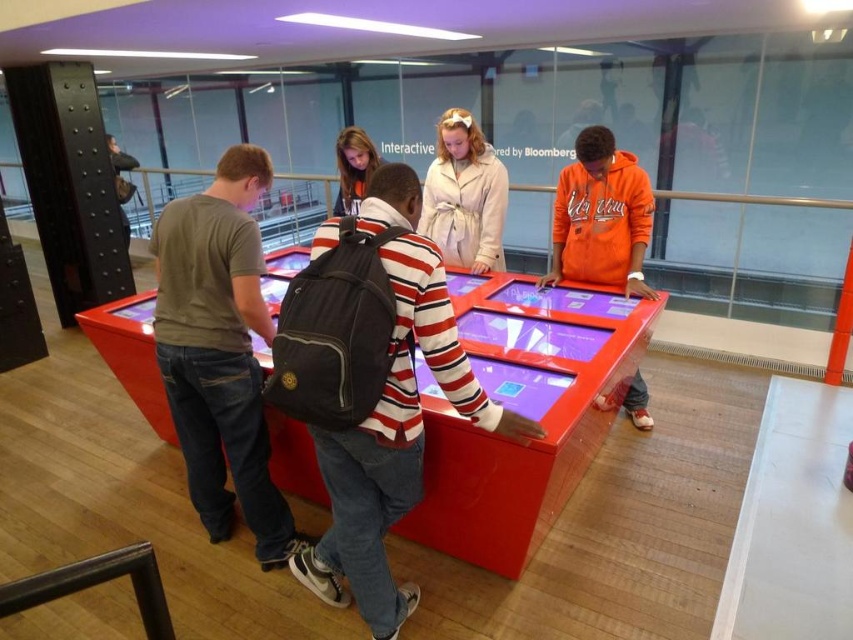
Can you confirm if orange fleece jacket at right is positioned above matte black backpack at center?

Incorrect, orange fleece jacket at right is not positioned above matte black backpack at center.

Can you confirm if orange fleece jacket at right is taller than matte black backpack at center?

Yes, orange fleece jacket at right is taller than matte black backpack at center.

The width and height of the screenshot is (853, 640). Find the location of `orange fleece jacket at right`. orange fleece jacket at right is located at coordinates (601, 216).

Does point (160, 234) lie behind point (419, 464)?

Yes, it is.

Does matte gray shirt at left have a greater width compared to striped cotton shirt at center?

In fact, matte gray shirt at left might be narrower than striped cotton shirt at center.

Between point (207, 332) and point (347, 547), which one is positioned behind?

The point (207, 332) is behind.

Locate an element on the screen. matte gray shirt at left is located at coordinates (219, 353).

Is orange fleece jacket at right to the right of dark gray backpack at upper left from the viewer's perspective?

Correct, you'll find orange fleece jacket at right to the right of dark gray backpack at upper left.

Does orange fleece jacket at right come in front of dark gray backpack at upper left?

Yes, orange fleece jacket at right is closer to the viewer.

Which is in front, point (630, 218) or point (109, 156)?

Point (630, 218) is in front.

This screenshot has width=853, height=640. In order to click on orange fleece jacket at right in this screenshot , I will do `click(601, 216)`.